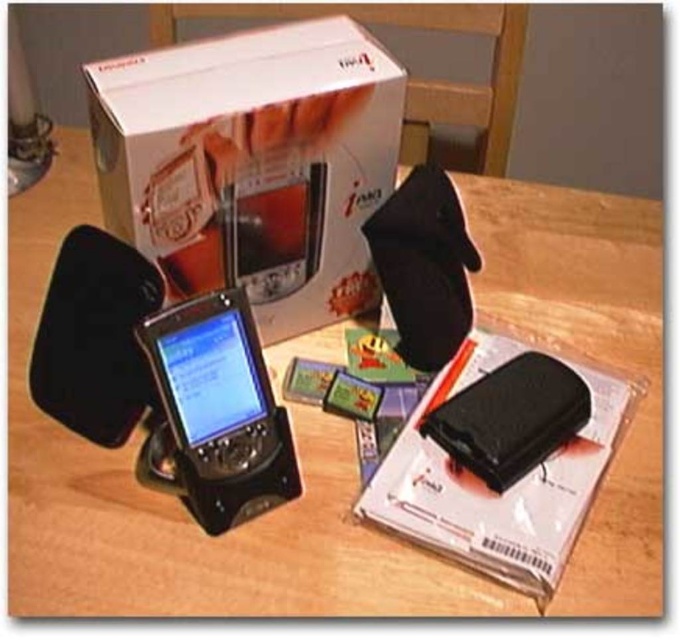
Between white cardboard box at upper center and matte black smartphone at center, which one is positioned higher?

white cardboard box at upper center is higher up.

Is white cardboard box at upper center above matte black smartphone at center?

Yes.

Who is more distant from viewer, (109, 148) or (194, 312)?

The point (109, 148) is more distant.

Locate an element on the screen. white cardboard box at upper center is located at coordinates (254, 164).